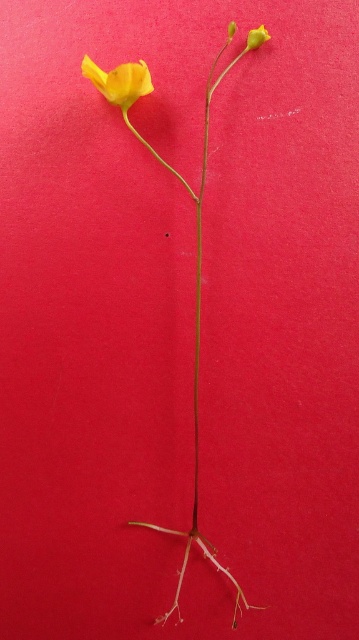
Question: Among these points, which one is farthest from the camera?

Choices:
 (A) (105, 81)
 (B) (253, 44)
 (C) (202, 547)

Answer: (C)

Question: Is matte yellow flower at upper left above smooth yellow flower at upper center?

Choices:
 (A) yes
 (B) no

Answer: (B)

Question: Which of the following is the farthest from the observer?

Choices:
 (A) smooth yellow flower at upper center
 (B) yellow matte flower at center

Answer: (B)

Question: Is yellow matte flower at center positioned at the back of matte yellow flower at upper left?

Choices:
 (A) yes
 (B) no

Answer: (A)

Question: Does yellow matte flower at center appear under smooth yellow flower at upper center?

Choices:
 (A) no
 (B) yes

Answer: (B)

Question: Which of the following is the closest to the observer?

Choices:
 (A) smooth yellow flower at upper center
 (B) matte yellow flower at upper left

Answer: (B)